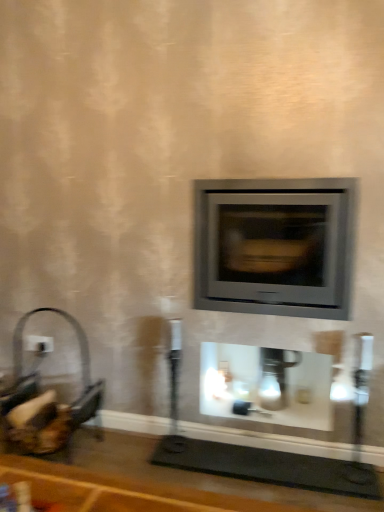
This screenshot has width=384, height=512. Find the location of `vacant space situated above white glossy fireplace at center (from a real-world perspective)`. vacant space situated above white glossy fireplace at center (from a real-world perspective) is located at coordinates (285, 402).